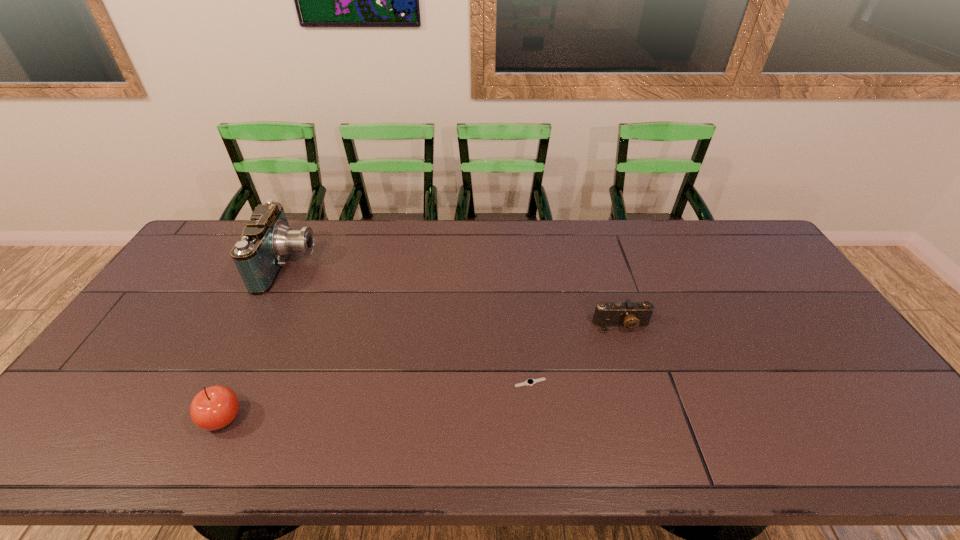
Where is `the tallest object`? The height and width of the screenshot is (540, 960). the tallest object is located at coordinates (260, 253).

Where is `camcorder`? This screenshot has width=960, height=540. camcorder is located at coordinates coord(260,253).

I want to click on the third shortest object, so click(x=215, y=407).

I want to click on apple, so click(215, 407).

This screenshot has height=540, width=960. Find the location of `the rightmost object`. the rightmost object is located at coordinates (629, 314).

Find the location of a particular element. The height and width of the screenshot is (540, 960). the second shortest object is located at coordinates (629, 314).

The image size is (960, 540). In order to click on the second object from right to left in this screenshot , I will do `click(529, 382)`.

Where is `the third farthest object`? the third farthest object is located at coordinates (529, 382).

Find the location of a particular element. The image size is (960, 540). vacant region located 0.360m on the front-facing side of the farthest object is located at coordinates (x=421, y=265).

Where is `free space located on the left of the nearest object`? Image resolution: width=960 pixels, height=540 pixels. free space located on the left of the nearest object is located at coordinates (173, 418).